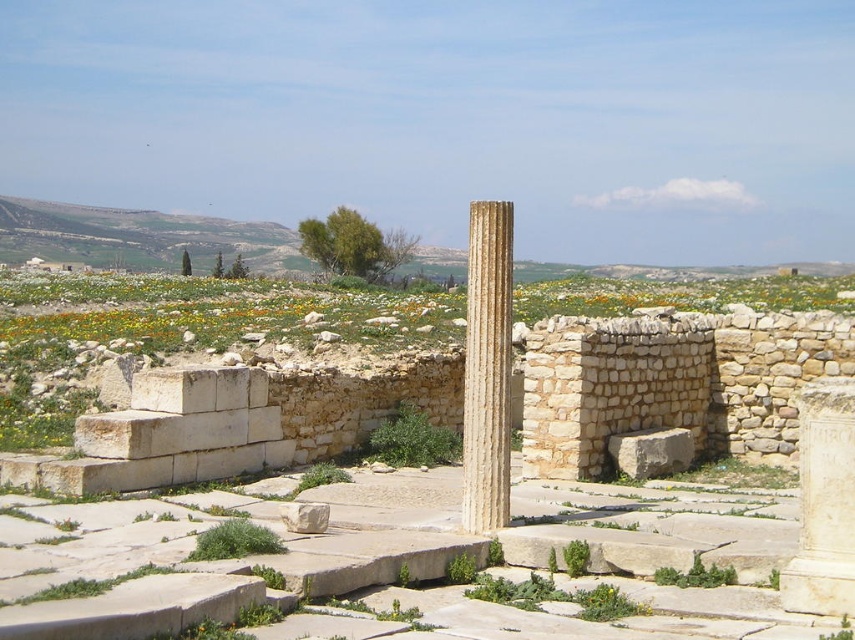
You are an archaeologist examining the site and need to determine the spatial relationship between two points marked on your map. The points are labeled as point [500,317] and point [842,436]. Which point is closer to you when standing at the observation point?

Point [500,317] is closer to you than point [842,436] because it is further to the viewer according to the description.

You are an archaeologist standing at the entrance of the site. You see the beige stone column at center and the white marble column at right. Which column is farther from your current position?

The white marble column at right is farther from your current position because it is positioned behind the beige stone column at center.